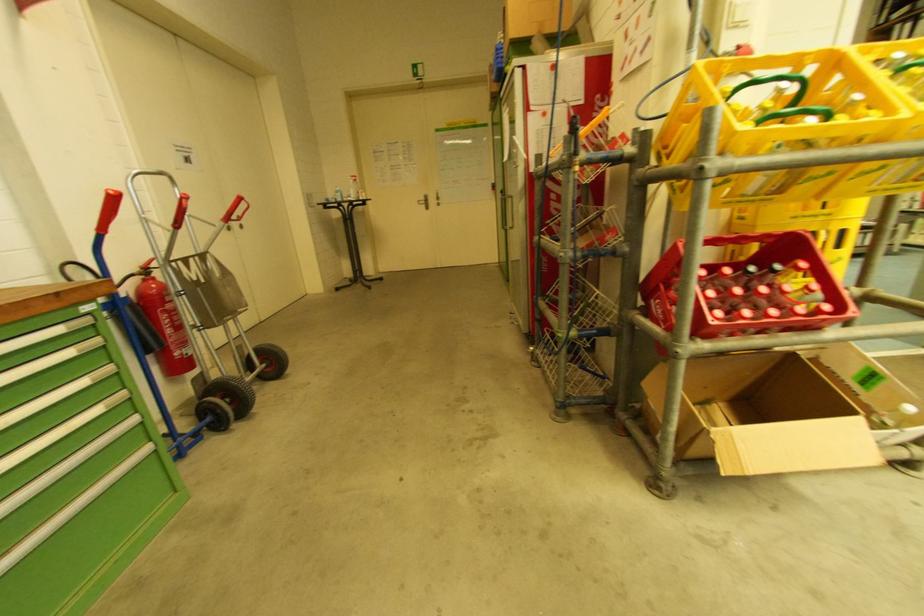
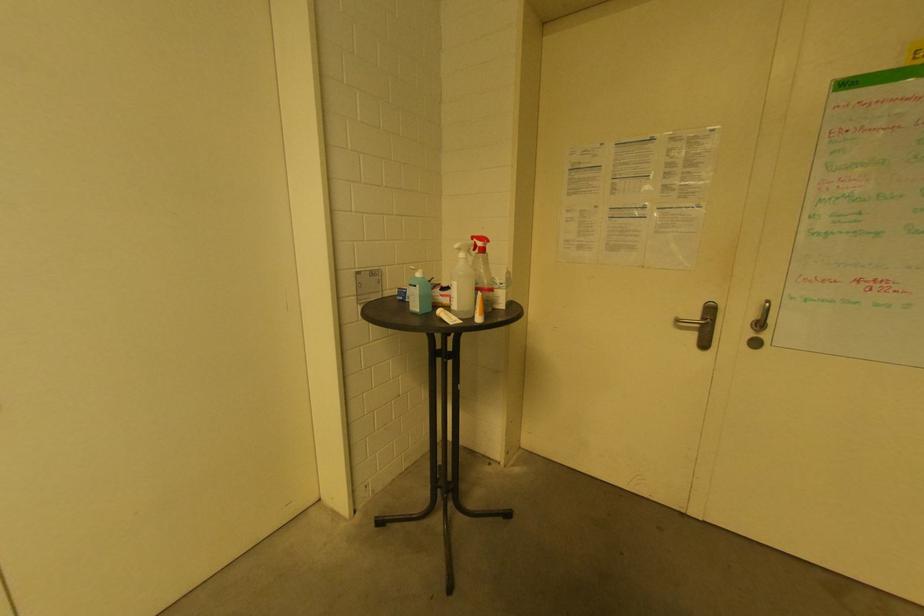
Find the pixel in the second image that matches (x=354, y=183) in the first image.

(464, 256)